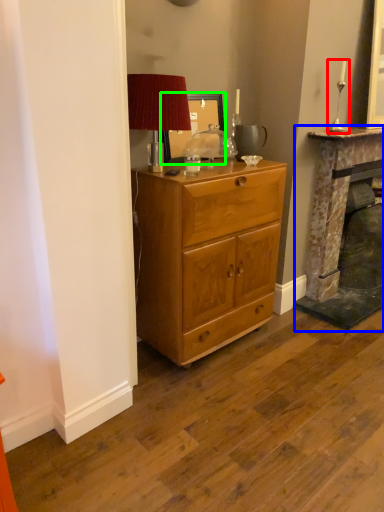
Question: Which object is positioned farthest from candle holder (highlighted by a red box)? Select from fireplace (highlighted by a blue box) and picture frame (highlighted by a green box).

Choices:
 (A) fireplace
 (B) picture frame

Answer: (B)